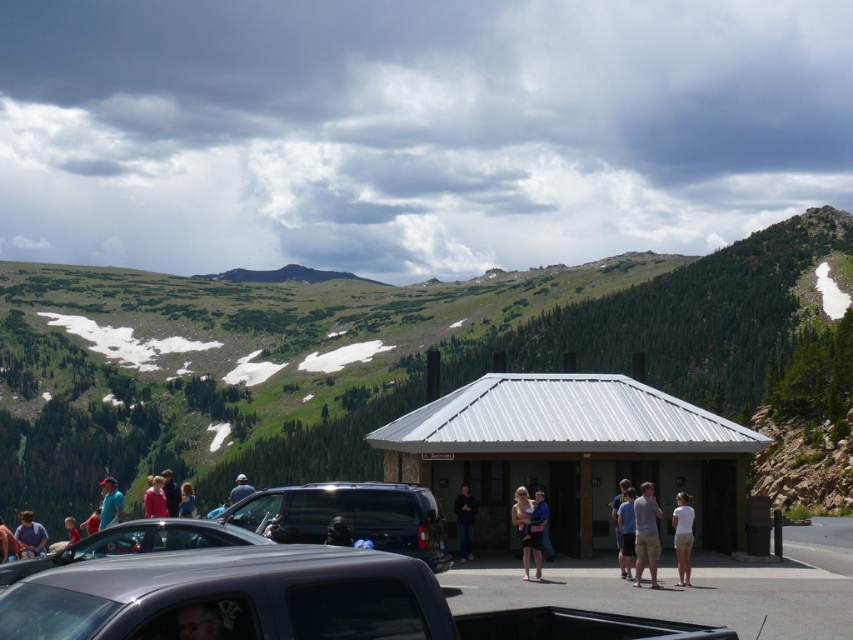
You are a photographer planning to capture a group photo of the people at the scenic outdoor location. You notice two individuals wearing tan cotton shorts at center and matte blue dress at center. Which clothing item would be more suitable for the cold mountain climate?

The matte blue dress at center is thicker than tan cotton shorts at center, making it more suitable for the cold mountain climate.